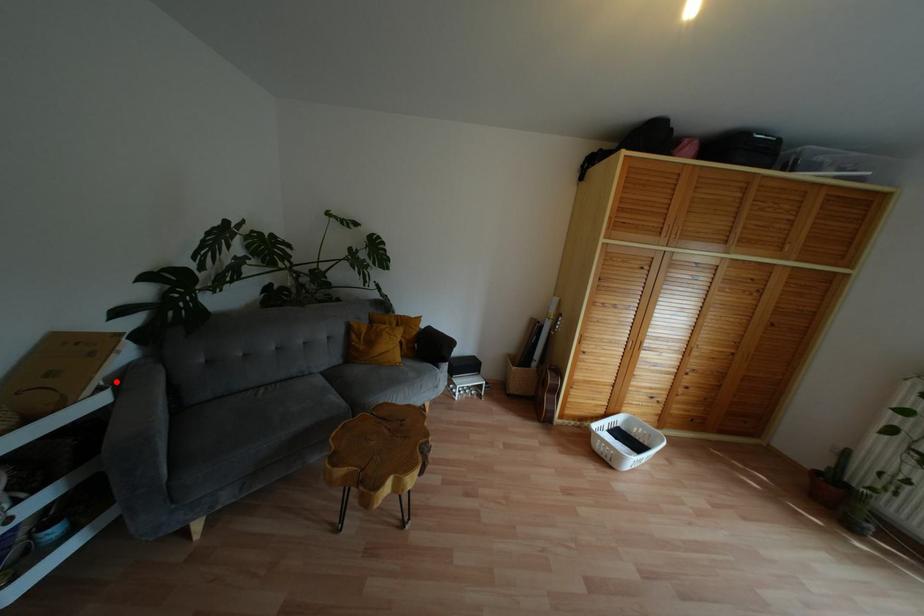
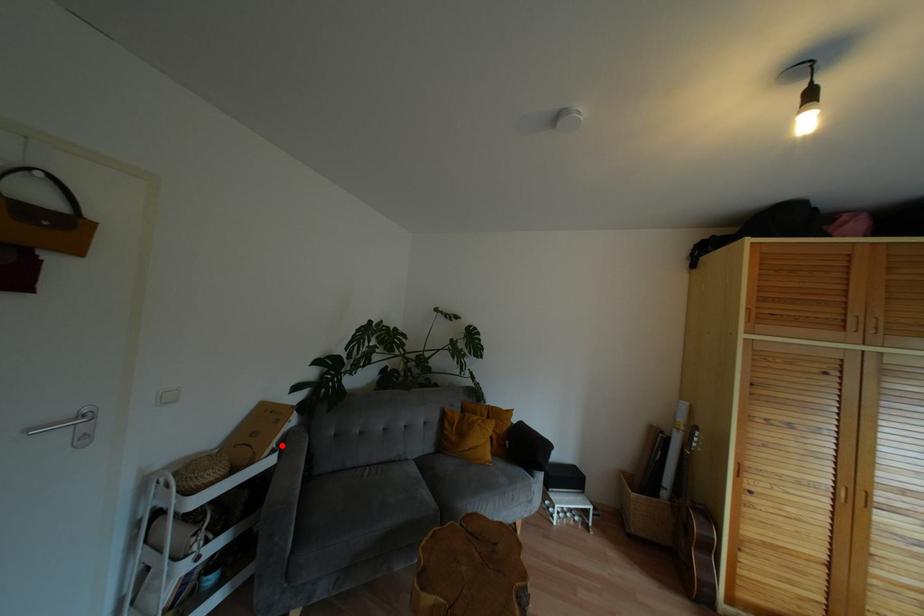
In the scene shown: I am providing you with two images of the same scene from different viewpoints. A red point is marked on the first image and another point is marked on the second image. Is the red point in image1 aligned with the point shown in image2?

Yes